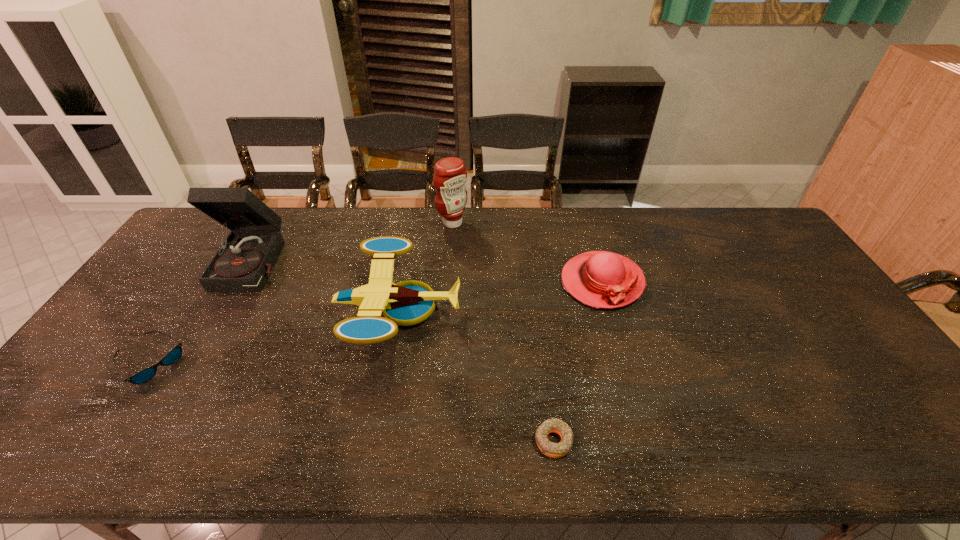
Locate an element on the screen. Image resolution: width=960 pixels, height=540 pixels. blank space located at the cockpit of the drone is located at coordinates (578, 310).

Identify the location of blank space located at the front of the rightmost object with a bow. (632, 383).

You are a GUI agent. You are given a task and a screenshot of the screen. Output one action in this format:
    pyautogui.click(x=<x>, y=<y>)
    Task: Click on the free location located 0.170m at the front of the second shortest object showing the lenses
    This screenshot has width=960, height=540.
    Given the screenshot: What is the action you would take?
    pyautogui.click(x=247, y=363)

At what (x,y) coordinates should I click in order to perform the action: click on free location located 0.370m on the right of the nearest object. Please return your answer as a coordinate pair (x, y). The height and width of the screenshot is (540, 960). Looking at the image, I should click on (736, 441).

Locate an element on the screen. The width and height of the screenshot is (960, 540). phonograph_record that is at the far edge is located at coordinates (243, 262).

At what (x,y) coordinates should I click in order to perform the action: click on condiment situated at the far edge. Please return your answer as a coordinate pair (x, y). The image size is (960, 540). Looking at the image, I should click on (450, 174).

Locate an element on the screen. The height and width of the screenshot is (540, 960). object located at the near edge is located at coordinates (555, 450).

Where is `object situated at the left edge`? This screenshot has height=540, width=960. object situated at the left edge is located at coordinates (170, 358).

Identify the location of vacant area at the far edge of the desktop. The width and height of the screenshot is (960, 540). (411, 213).

Locate an element on the screen. The height and width of the screenshot is (540, 960). vacant space at the near edge of the desktop is located at coordinates (829, 437).